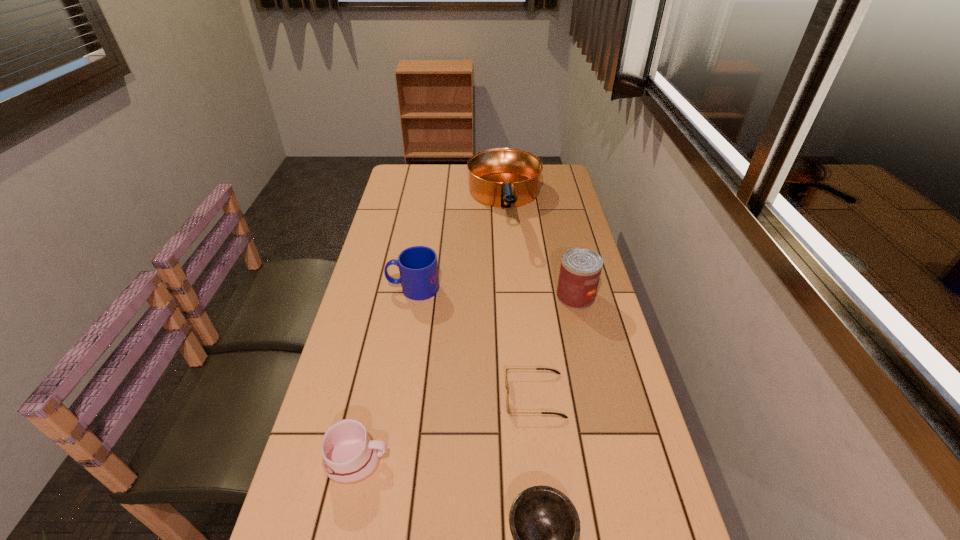
Locate an element on the screen. vacant space located 0.150m on the front of the fifth shortest object is located at coordinates [588, 349].

Locate an element on the screen. vacant space located on the side with the handle of the farther mug is located at coordinates (372, 288).

Identify the location of free space located 0.130m on the side with the handle of the fourth tallest object. (448, 461).

This screenshot has height=540, width=960. I want to click on vacant area situated on the front-facing side of the sunglasses, so click(x=424, y=396).

Where is `blank space located 0.300m on the front-facing side of the sunglasses`? blank space located 0.300m on the front-facing side of the sunglasses is located at coordinates (383, 396).

Identify the location of vacant area situated 0.090m on the front-facing side of the sunglasses. (468, 396).

Locate an element on the screen. The image size is (960, 540). object located in the far edge section of the desktop is located at coordinates (501, 177).

The width and height of the screenshot is (960, 540). In order to click on frying pan that is at the right edge in this screenshot , I will do `click(501, 177)`.

You are a GUI agent. You are given a task and a screenshot of the screen. Output one action in this format:
    pyautogui.click(x=<x>, y=<y>)
    Task: Click on the can that is positioned at the right edge
    This screenshot has height=540, width=960.
    Given the screenshot: What is the action you would take?
    pyautogui.click(x=580, y=270)

Identify the location of object present at the far right corner. (501, 177).